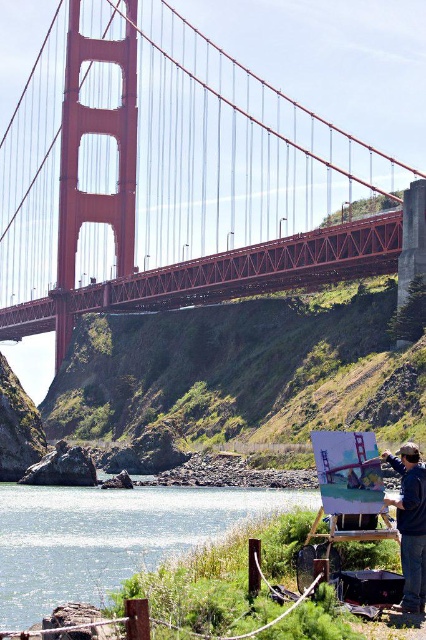
Does red painted steel suspension bridge at center have a smaller size compared to clear water at lower left?

Actually, red painted steel suspension bridge at center might be larger than clear water at lower left.

Is red painted steel suspension bridge at center positioned in front of clear water at lower left?

No, red painted steel suspension bridge at center is further to the viewer.

Is point (147, 221) behind point (152, 529)?

Yes, it is.

Find the location of a particular element. Image resolution: width=426 pixels, height=640 pixels. red painted steel suspension bridge at center is located at coordinates (196, 188).

Measure the distance from red painted steel suspension bridge at center to dark blue fabric at lower right.

red painted steel suspension bridge at center is 173.64 meters from dark blue fabric at lower right.

Is red painted steel suspension bridge at center above dark blue fabric at lower right?

Yes.

Between point (72, 269) and point (408, 566), which one is positioned in front?

Point (408, 566) is more forward.

At what (x,y) coordinates should I click in order to perform the action: click on red painted steel suspension bridge at center. Please return your answer as a coordinate pair (x, y). The image size is (426, 640). Looking at the image, I should click on [x=196, y=188].

Does clear water at lower left have a larger size compared to dark blue fabric at lower right?

Yes.

Who is lower down, clear water at lower left or dark blue fabric at lower right?

clear water at lower left

Does point (154, 534) lie behind point (399, 468)?

Yes.

The width and height of the screenshot is (426, 640). In order to click on clear water at lower left in this screenshot , I will do click(109, 538).